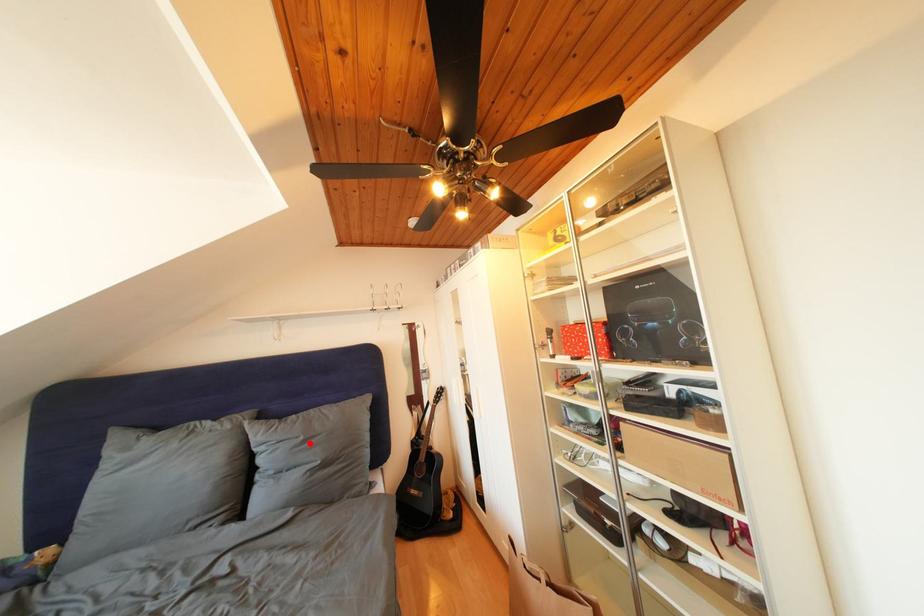
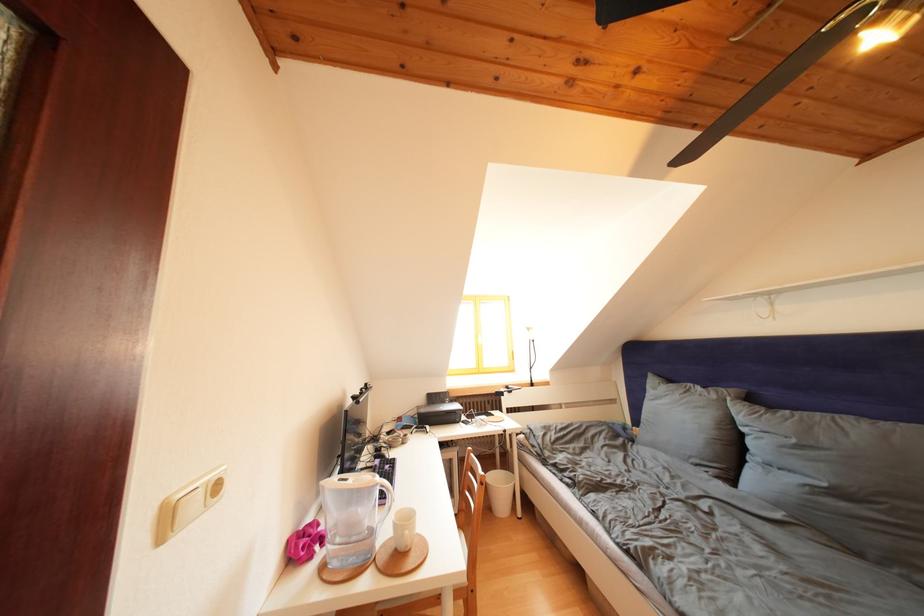
Question: A red point is marked in image1. In image2, is the corresponding 3D point closer to the camera or farther? Reply with the corresponding letter.

Choices:
 (A) The corresponding 3D point is closer.
 (B) The corresponding 3D point is farther.

Answer: (A)